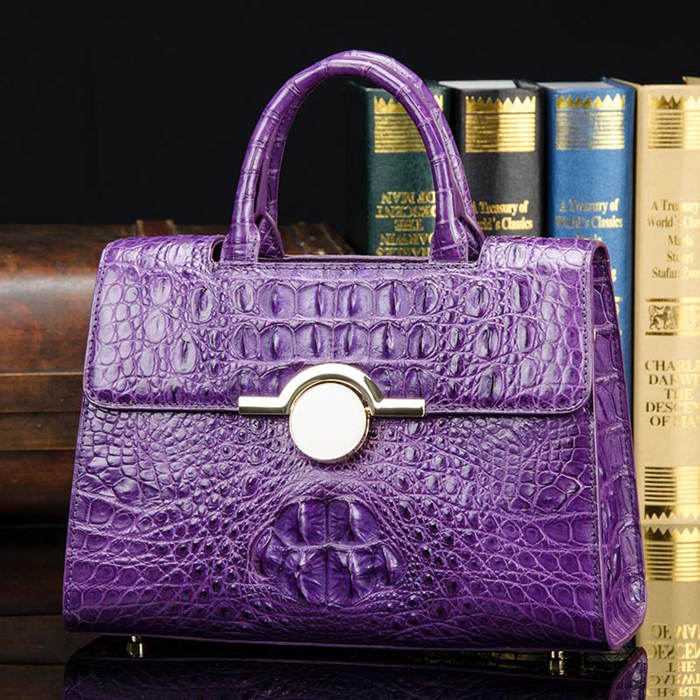
You are a GUI agent. You are given a task and a screenshot of the screen. Output one action in this format:
    pyautogui.click(x=<x>, y=<y>)
    Task: Click on the table
    
    Given the screenshot: What is the action you would take?
    pyautogui.click(x=43, y=626)